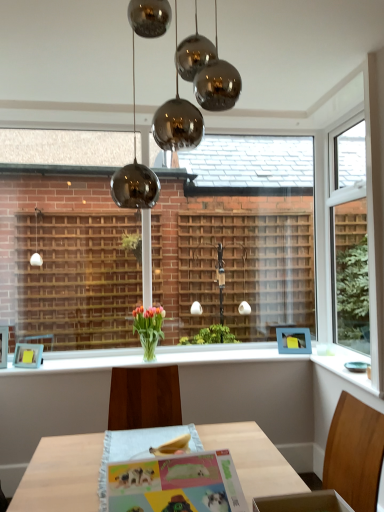
Question: In terms of size, does matte glass vase at center appear bigger or smaller than matte paper postcard at center?

Choices:
 (A) big
 (B) small

Answer: (A)

Question: Is matte glass vase at center in front of or behind matte paper postcard at center in the image?

Choices:
 (A) front
 (B) behind

Answer: (B)

Question: Estimate the real-world distances between objects in this image. Which object is closer to the blue matte picture frame at upper right, placed as the first picture frame when sorted from right to left?

Choices:
 (A) translucent glass vase at center
 (B) white glossy plate at lower right, acting as the 2th window sill starting from the left
 (C) polished chrome chandelier at upper center
 (D) white glossy window sill at center, positioned as the second window sill in right-to-left order
 (E) matte glass vase at center

Answer: (B)

Question: Estimate the real-world distances between objects in this image. Which object is farther from the white glossy plate at lower right, acting as the 2th window sill starting from the left?

Choices:
 (A) translucent glass vase at center
 (B) blue matte picture frame at upper right, which is counted as the second picture frame, starting from the front
 (C) polished chrome chandelier at upper center
 (D) matte blue picture frame at lower left, the second picture frame when ordered from right to left
 (E) white glossy window sill at center, placed as the 1th window sill when sorted from left to right

Answer: (D)